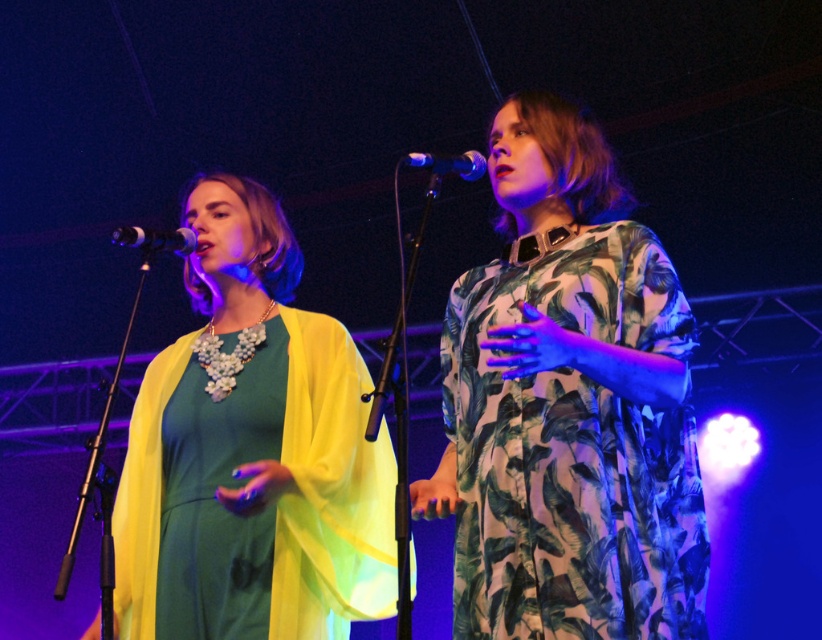
Can you confirm if matte green dress at center is thinner than green leafy fabric dress at center?

No.

Does matte green dress at center have a greater width compared to green leafy fabric dress at center?

Indeed, matte green dress at center has a greater width compared to green leafy fabric dress at center.

Who is more distant from viewer, (257, 577) or (474, 364)?

The point (257, 577) is more distant.

Locate an element on the screen. The width and height of the screenshot is (822, 640). matte green dress at center is located at coordinates (252, 452).

Looking at this image, who is higher up, green leafy fabric dress at center or metallic silver microphone at center?

metallic silver microphone at center is above.

Between green leafy fabric dress at center and metallic silver microphone at center, which one has less height?

With less height is metallic silver microphone at center.

This screenshot has height=640, width=822. What are the coordinates of `green leafy fabric dress at center` in the screenshot? It's located at (573, 454).

The width and height of the screenshot is (822, 640). Find the location of `green leafy fabric dress at center`. green leafy fabric dress at center is located at coordinates (573, 454).

Does metallic silver microphone at left have a lesser height compared to metallic silver microphone at center?

Yes, metallic silver microphone at left is shorter than metallic silver microphone at center.

Does metallic silver microphone at left lie in front of metallic silver microphone at center?

No, metallic silver microphone at left is further to the viewer.

Between point (118, 227) and point (483, 157), which one is positioned behind?

The point (118, 227) is more distant.

Locate an element on the screen. The height and width of the screenshot is (640, 822). metallic silver microphone at left is located at coordinates (156, 237).